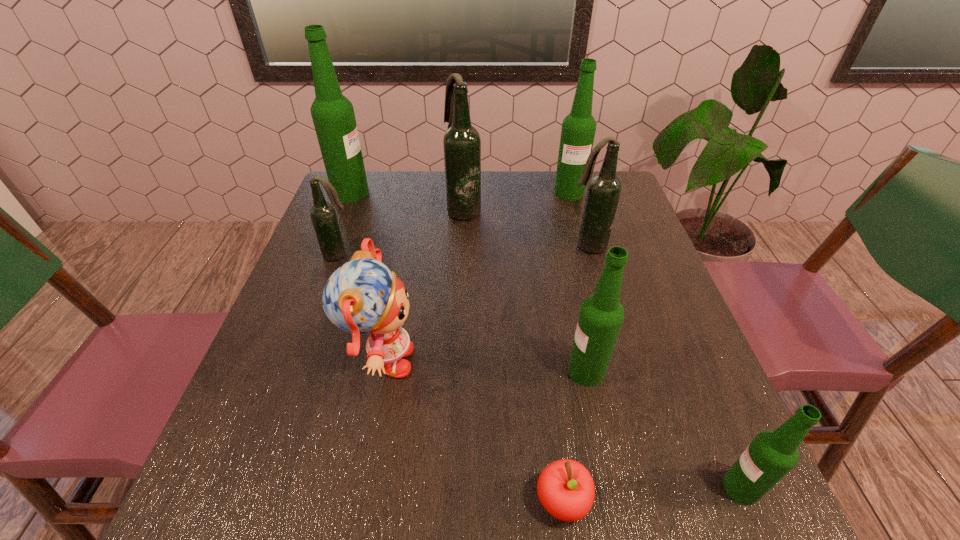
You are a GUI agent. You are given a task and a screenshot of the screen. Output one action in this format:
    pyautogui.click(x=<x>, y=<y>)
    Task: Click on the leftmost green beer bottle
    
    Given the screenshot: What is the action you would take?
    pyautogui.click(x=333, y=115)

This screenshot has width=960, height=540. In order to click on the tallest beer bottle in this screenshot , I will do `click(333, 115)`.

Identify the location of the third smallest green beer bottle. This screenshot has height=540, width=960. (578, 130).

Find the location of a particular element. the fifth beer bottle from right to left is located at coordinates (462, 144).

Where is `the farthest dark beer bottle`? The width and height of the screenshot is (960, 540). the farthest dark beer bottle is located at coordinates (462, 144).

Where is `the rightmost dark beer bottle`? the rightmost dark beer bottle is located at coordinates (603, 193).

Identify the location of the second nearest green beer bottle. This screenshot has width=960, height=540. (601, 315).

Find the location of a particular element. Image resolution: width=960 pixels, height=540 pixels. the sixth farthest beer bottle is located at coordinates (601, 315).

Identify the location of the seventh object from right to left. This screenshot has width=960, height=540. (361, 296).

The height and width of the screenshot is (540, 960). I want to click on the leftmost dark beer bottle, so click(323, 215).